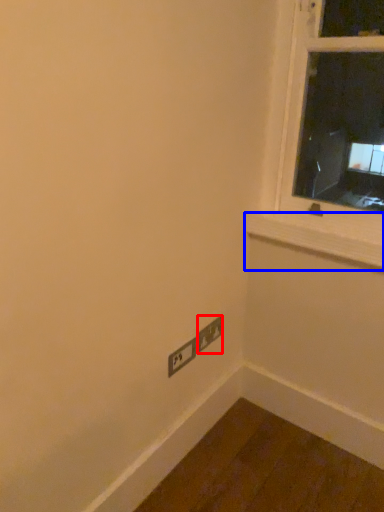
Question: Among these objects, which one is farthest to the camera, power plugs and sockets (highlighted by a red box) or window sill (highlighted by a blue box)?

Choices:
 (A) power plugs and sockets
 (B) window sill

Answer: (A)